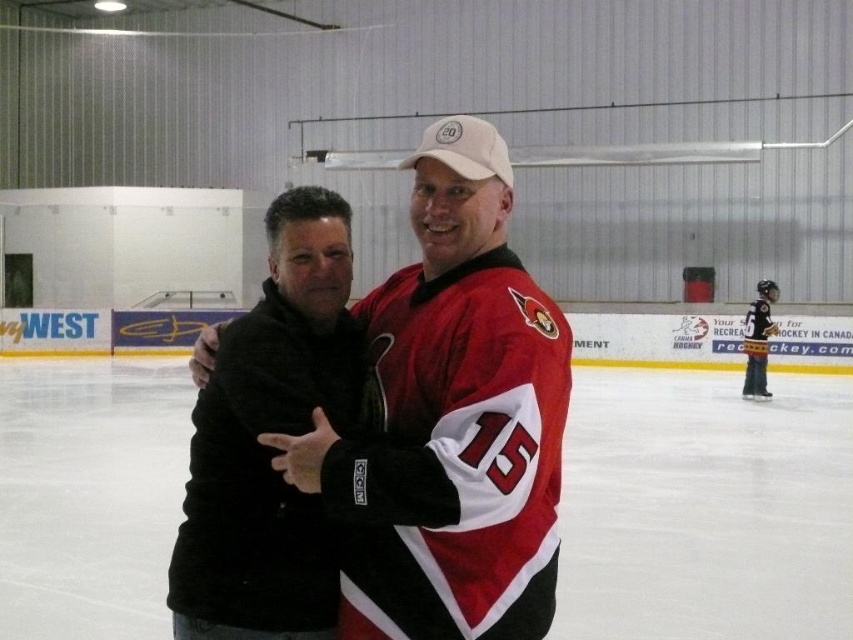
You are a photographer standing at the entrance of the ice rink. You want to take a photo of both the matte black jacket at center and the black fuzzy jacket at center. If you need to ensure both jackets are fully visible in the frame, which jacket should you adjust your camera angle to focus on first?

The matte black jacket at center might be wider than black fuzzy jacket at center, so you should focus on the matte black jacket at center first to ensure it fits within the frame.

You are a photographer standing at the edge of an indoor ice rink. You want to take a photo of the matte black jacket at center and the black fuzzy jacket at center so that both are in focus. The camera you are using has a depth of field that can cover 12 inches. Will both jackets be in focus in the photo?

The distance between the matte black jacket at center and the black fuzzy jacket at center is 11.51 inches, which is within the camera depth of field of 12 inches. Therefore, both jackets will be in focus in the photo.

You are a photographer positioned at the back of the ice rink. You want to take a photo of both the matte black jacket at center and the black jersey at right. Which person should you focus on first to ensure both are in frame?

You should focus on the matte black jacket at center first since it is in front of the black jersey at right, ensuring both are visible in the photo.